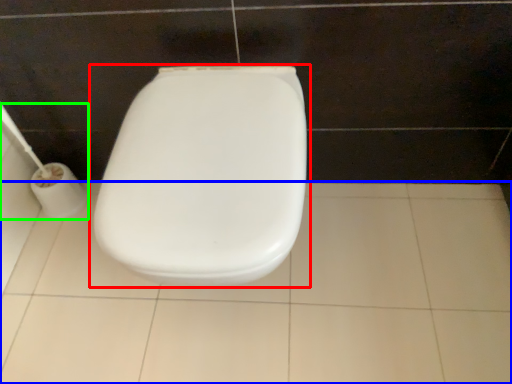
Question: Which is nearer to the toilet (highlighted by a red box)? ceramic tile (highlighted by a blue box) or toilet paper (highlighted by a green box).

Choices:
 (A) ceramic tile
 (B) toilet paper

Answer: (A)